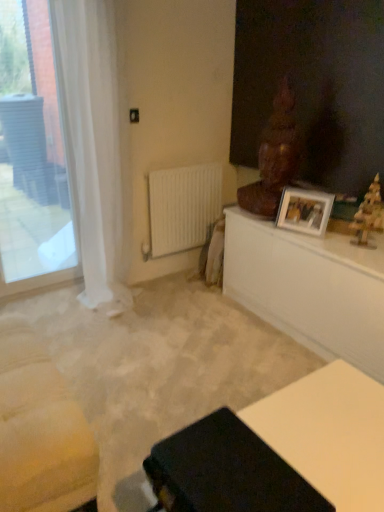
Where is `vacant position to the left of white sheer curtain at left`? vacant position to the left of white sheer curtain at left is located at coordinates [x=60, y=307].